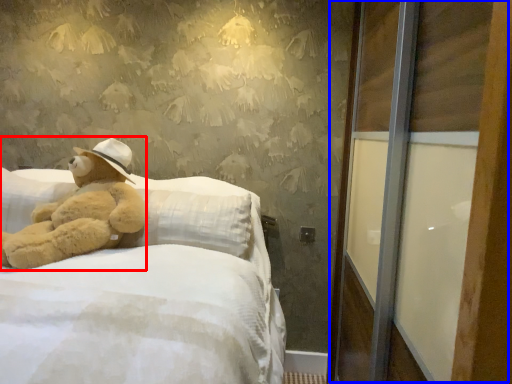
Question: Among these objects, which one is farthest to the camera, teddy bear (highlighted by a red box) or screen door (highlighted by a blue box)?

Choices:
 (A) teddy bear
 (B) screen door

Answer: (A)